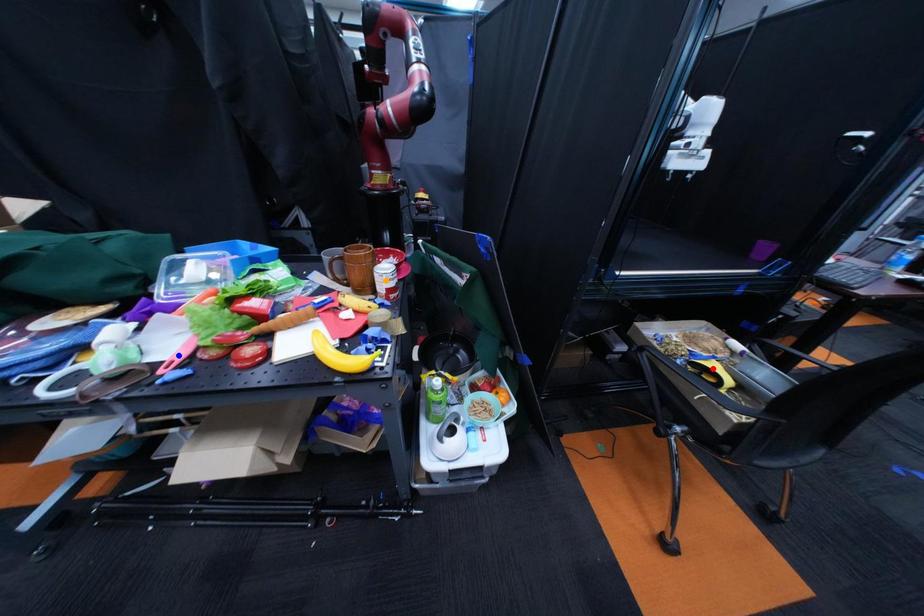
Order these from nearest to farthest:
red point | blue point | orange point

blue point → orange point → red point